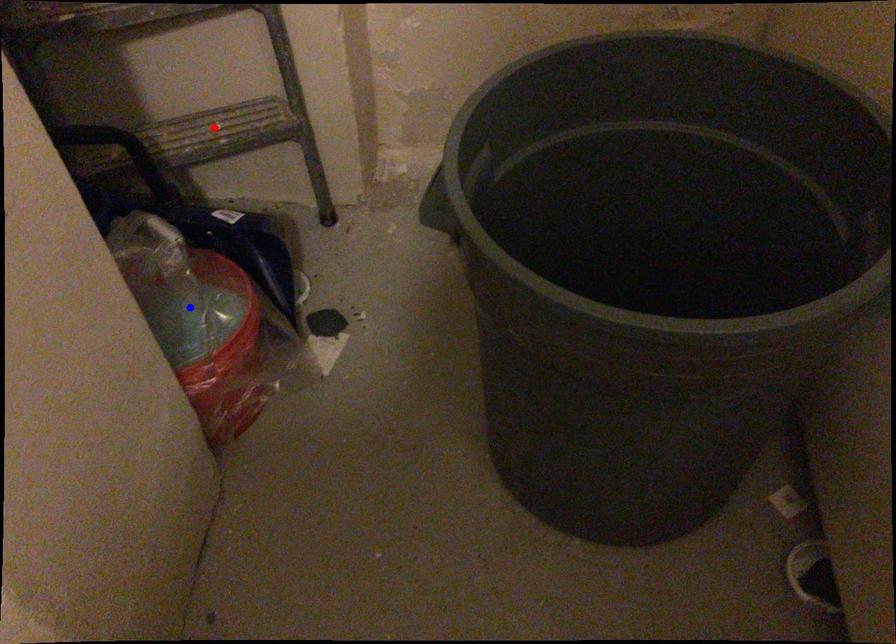
Question: In the image, two points are highlighted. Which point is nearer to the camera? Reply with the corresponding letter.

Choices:
 (A) blue point
 (B) red point

Answer: (A)